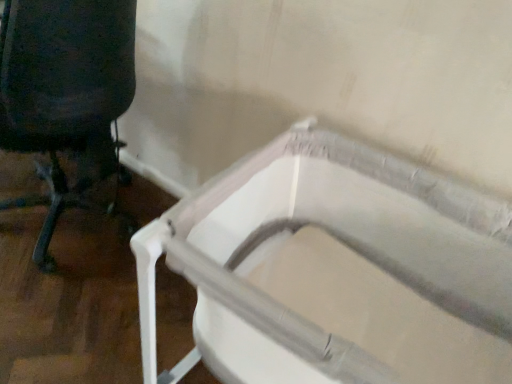
Question: Does point (47, 228) appear closer or farther from the camera than point (347, 142)?

Choices:
 (A) farther
 (B) closer

Answer: (A)

Question: In terms of width, does black fabric chair at left look wider or thinner when compared to white plastic bath at center?

Choices:
 (A) thin
 (B) wide

Answer: (A)

Question: From their relative heights in the image, would you say black fabric chair at left is taller or shorter than white plastic bath at center?

Choices:
 (A) tall
 (B) short

Answer: (A)

Question: Considering the positions of white plastic bath at center and black fabric chair at left in the image, is white plastic bath at center wider or thinner than black fabric chair at left?

Choices:
 (A) wide
 (B) thin

Answer: (A)

Question: Based on their sizes in the image, would you say white plastic bath at center is bigger or smaller than black fabric chair at left?

Choices:
 (A) small
 (B) big

Answer: (A)

Question: Considering the relative positions of white plastic bath at center and black fabric chair at left in the image provided, is white plastic bath at center to the left or to the right of black fabric chair at left?

Choices:
 (A) left
 (B) right

Answer: (B)

Question: Is white plastic bath at center situated inside black fabric chair at left or outside?

Choices:
 (A) outside
 (B) inside

Answer: (A)